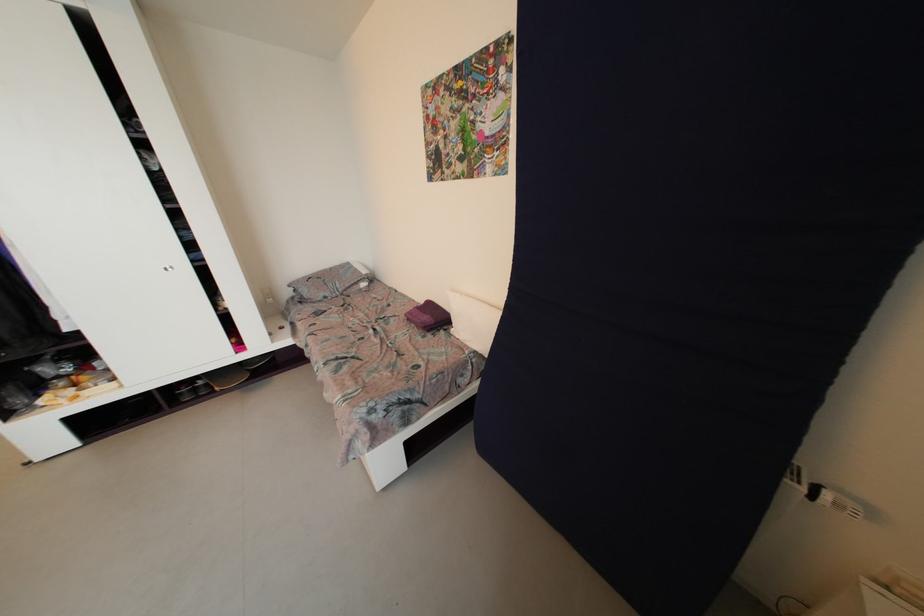
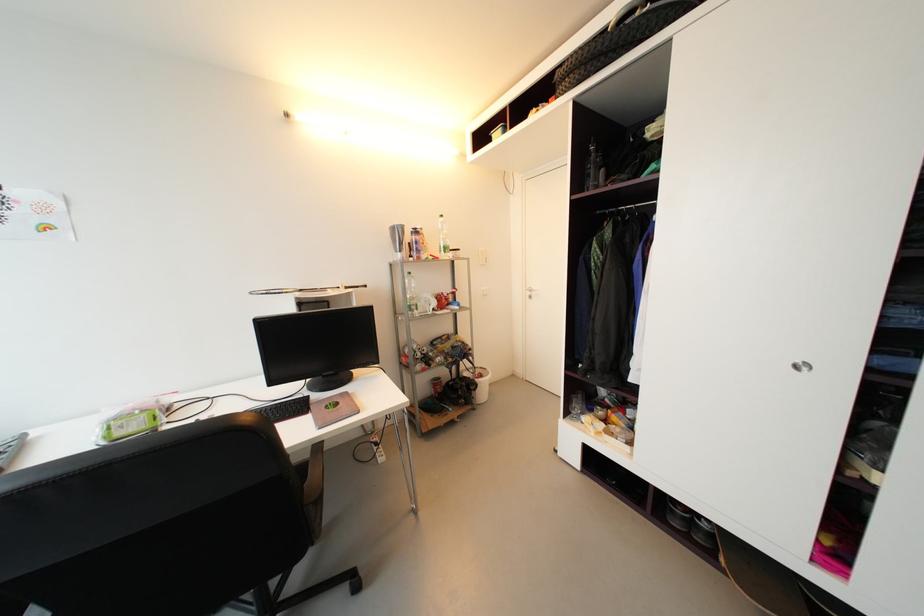
Find the pixel in the second image that matches (x=205, y=385) in the first image.

(710, 527)